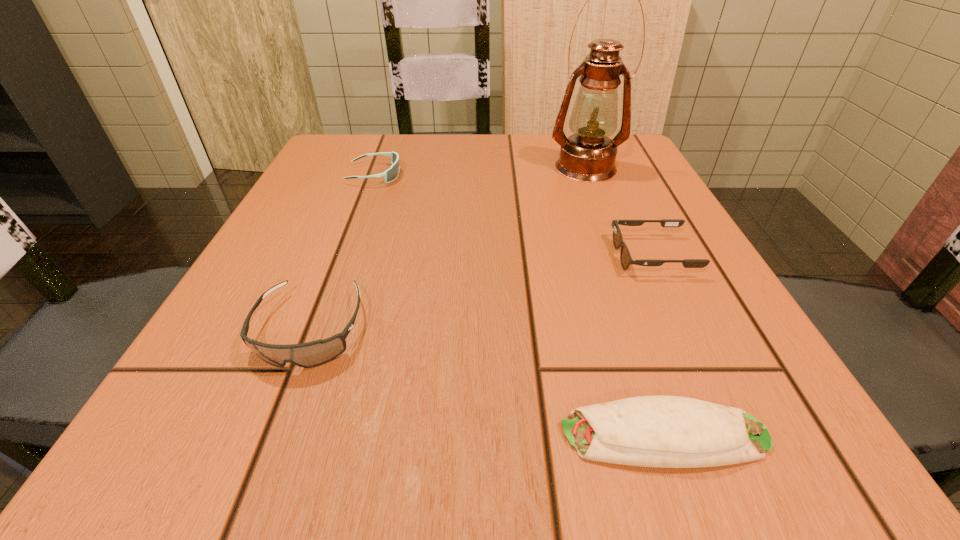
This screenshot has width=960, height=540. In order to click on vacant area that lies between the burrito and the sunglasses in this screenshot , I will do `click(659, 346)`.

Image resolution: width=960 pixels, height=540 pixels. I want to click on free spot between the taller goggles and the tallest object, so click(x=448, y=248).

At what (x,y) coordinates should I click in order to perform the action: click on vacant point located between the sunglasses and the tallest object. Please return your answer as a coordinate pair (x, y). Looking at the image, I should click on (619, 212).

Where is `vacant space that is in between the burrito and the sunglasses`? The height and width of the screenshot is (540, 960). vacant space that is in between the burrito and the sunglasses is located at coordinates (659, 346).

Locate an element on the screen. The image size is (960, 540). free spot between the nearer goggles and the nearest object is located at coordinates (488, 382).

Identify the location of free space that is in between the burrito and the oil lamp. Image resolution: width=960 pixels, height=540 pixels. (625, 301).

Where is `free spot between the burrito and the taller goggles`? This screenshot has height=540, width=960. free spot between the burrito and the taller goggles is located at coordinates (488, 382).

This screenshot has width=960, height=540. I want to click on vacant area between the tallest object and the shorter goggles, so click(480, 171).

You are a GUI agent. You are given a task and a screenshot of the screen. Output one action in this format:
    pyautogui.click(x=<x>, y=<y>)
    Task: Click on the empty location between the third nearest object and the shorter goggles
    The image size is (960, 540).
    Given the screenshot: What is the action you would take?
    pyautogui.click(x=514, y=215)

I want to click on free space between the shorter goggles and the tallest object, so click(480, 171).